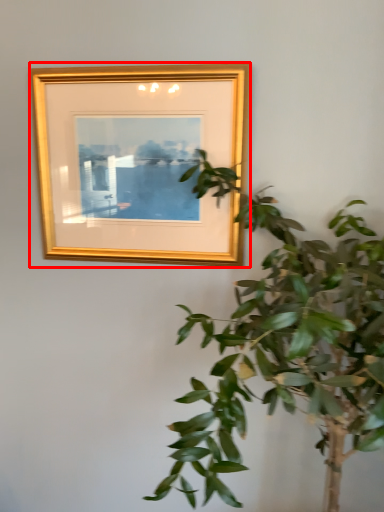
Question: Considering the relative positions of picture frame (annotated by the red box) and houseplant in the image provided, where is picture frame (annotated by the red box) located with respect to the staircase?

Choices:
 (A) right
 (B) left

Answer: (B)